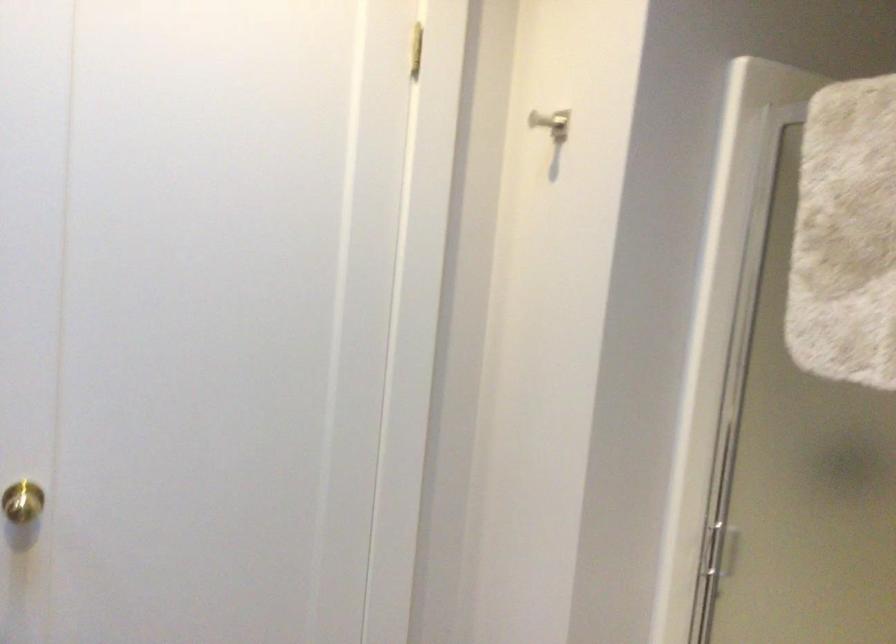
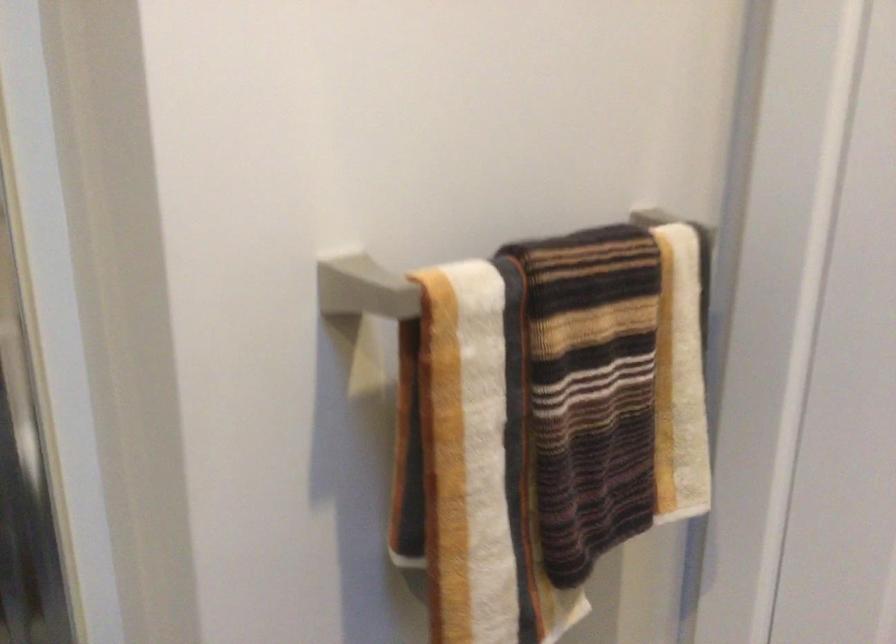
First-person continuous shooting, in which direction is the camera rotating?

The rotation direction of the camera is right-down.